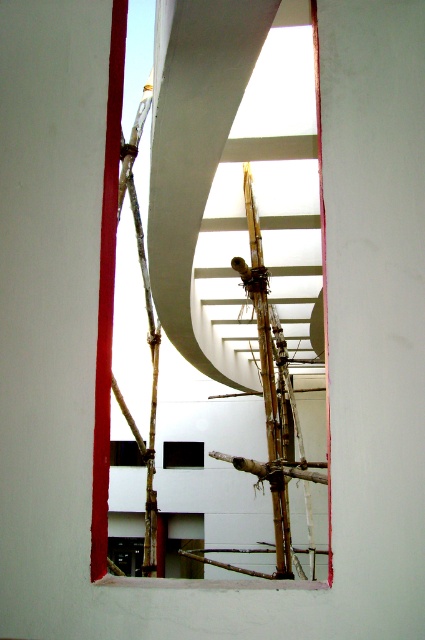
You are standing in front of the rectangular opening framed by red edges and looking through the transparent plastic hole at center and the transparent glass hole at lower center. Which of these two holes is positioned more to the right side of the opening?

The transparent plastic hole at center is positioned more to the right side of the opening compared to the transparent glass hole at lower center.

You are standing at the camera position looking through the rectangular opening. There is a point marked at coordinates point (x=181, y=445). Can you reach this point without moving your position?

The point (x=181, y=445) is 26.58 meters away from the camera, so you cannot reach it without moving your position.